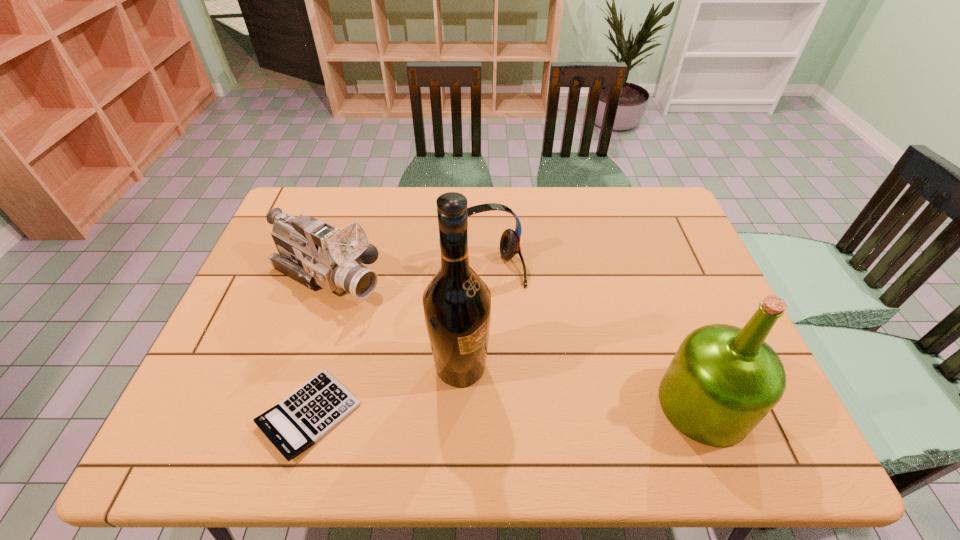
Where is `vacant space that's between the calculator and the camcorder`? This screenshot has width=960, height=540. vacant space that's between the calculator and the camcorder is located at coordinates (319, 346).

Where is `free space between the tallest object and the camcorder`? free space between the tallest object and the camcorder is located at coordinates (395, 322).

Locate an element on the screen. empty space between the headset and the camcorder is located at coordinates (406, 273).

Point out which object is positioned as the second nearest to the wine bottle. Please provide its 2D coordinates. Your answer should be formatted as a tuple, i.e. [(x, y)], where the tuple contains the x and y coordinates of a point satisfying the conditions above.

[(314, 253)]

I want to click on object that is the third closest to the headset, so click(299, 421).

The height and width of the screenshot is (540, 960). Find the location of `free location that satisfies the following two spatial constraints: 1. on the front side of the fourth shortest object; 2. on the left side of the wine bottle`. free location that satisfies the following two spatial constraints: 1. on the front side of the fourth shortest object; 2. on the left side of the wine bottle is located at coordinates click(459, 404).

Identify the location of free space in the image that satisfies the following two spatial constraints: 1. on the back side of the headset; 2. on the right side of the calculator. (351, 268).